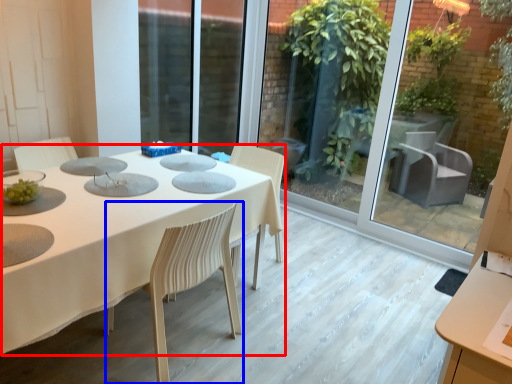
Question: Among these objects, which one is farthest to the camera, table (highlighted by a red box) or chair (highlighted by a blue box)?

Choices:
 (A) table
 (B) chair

Answer: (B)